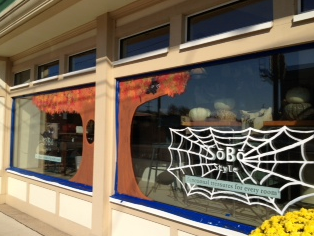
Where is `blue trim`? blue trim is located at coordinates (164, 207), (51, 180).